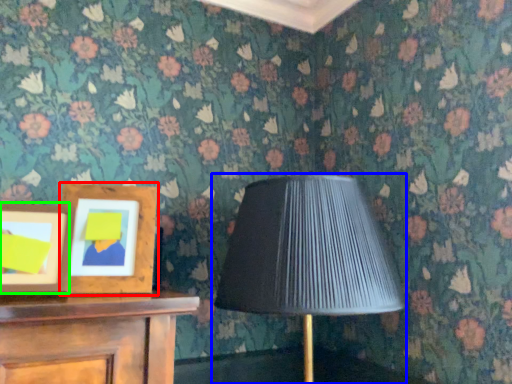
Question: Which object is positioned farthest from picture frame (highlighted by a red box)? Select from lamp (highlighted by a blue box) and picture frame (highlighted by a green box).

Choices:
 (A) lamp
 (B) picture frame

Answer: (A)